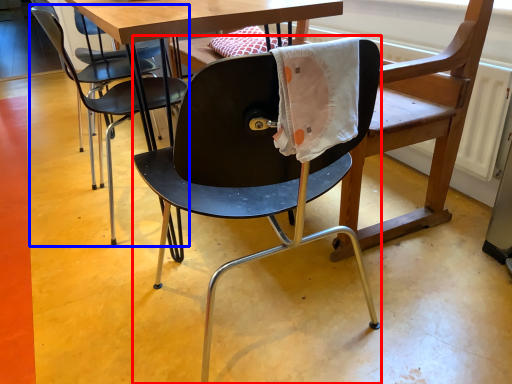
Question: Which object is further to the camera taking this photo, chair (highlighted by a red box) or chair (highlighted by a blue box)?

Choices:
 (A) chair
 (B) chair

Answer: (B)